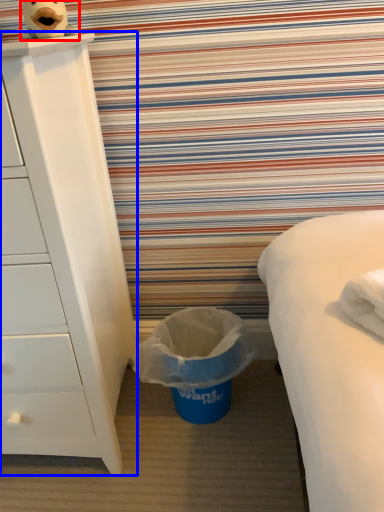
Question: Which object appears closest to the camera in this image, toy (highlighted by a red box) or chest of drawers (highlighted by a blue box)?

Choices:
 (A) toy
 (B) chest of drawers

Answer: (B)